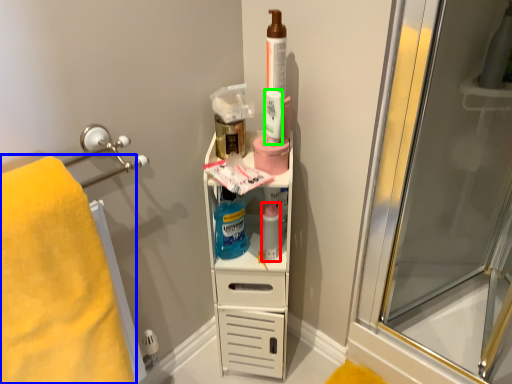
Question: Which object is the closest to the mouthwash (highlighted by a red box)? Choose among these: towel (highlighted by a blue box) or mouthwash (highlighted by a green box).

Choices:
 (A) towel
 (B) mouthwash

Answer: (B)